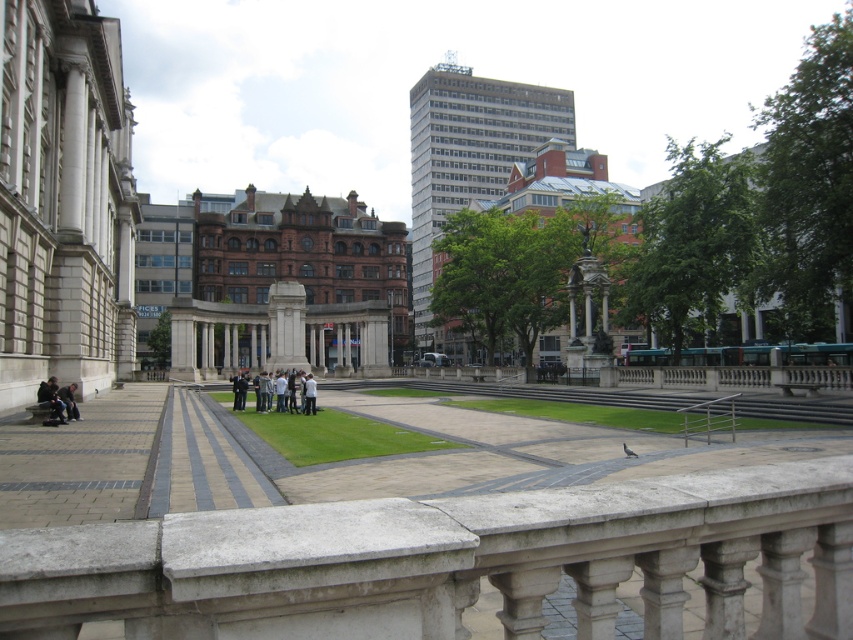
Who is taller, dark gray stone bench at lower left or dark gray fabric jacket at lower left?

With more height is dark gray stone bench at lower left.

Is dark gray stone bench at lower left thinner than dark gray fabric jacket at lower left?

No, dark gray stone bench at lower left is not thinner than dark gray fabric jacket at lower left.

Locate an element on the screen. dark gray stone bench at lower left is located at coordinates (50, 401).

Between gray concrete path at center and light gray concrete people at center, which one has more height?

light gray concrete people at center is taller.

Between gray concrete path at center and light gray concrete people at center, which one is positioned higher?

light gray concrete people at center is above.

Which is behind, point (198, 460) or point (277, 394)?

Point (277, 394)

This screenshot has width=853, height=640. I want to click on gray concrete path at center, so click(x=202, y=461).

Can you confirm if gray concrete path at center is thinner than dark gray fabric jacket at lower left?

In fact, gray concrete path at center might be wider than dark gray fabric jacket at lower left.

Does point (195, 472) lie behind point (64, 406)?

That is False.

Does point (207, 419) come farther from viewer compared to point (70, 396)?

Yes.

I want to click on gray concrete path at center, so click(202, 461).